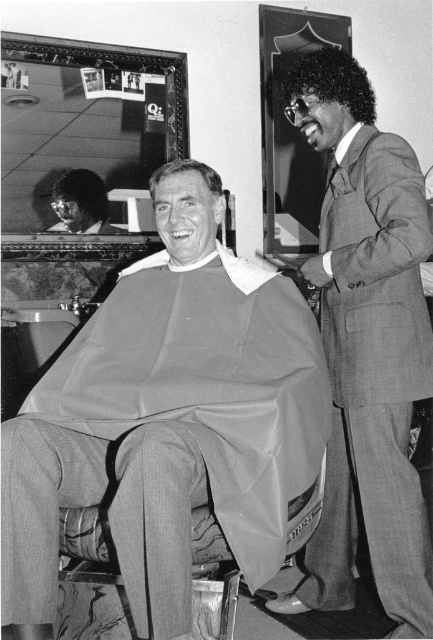
Question: Can you confirm if sleek black afro at upper right is bigger than shiny black hair at upper left?

Choices:
 (A) no
 (B) yes

Answer: (B)

Question: Can you confirm if shiny black hair at upper left is thinner than smooth gray hair at center?

Choices:
 (A) yes
 (B) no

Answer: (B)

Question: Which point appears closest to the camera in this image?

Choices:
 (A) (67, 346)
 (B) (314, 88)
 (C) (86, 172)
 (D) (187, 161)

Answer: (B)

Question: Does gray fabric at center have a greater width compared to smooth suit at right?

Choices:
 (A) yes
 (B) no

Answer: (A)

Question: Considering the real-world distances, which object is closest to the smooth gray hair at center?

Choices:
 (A) shiny black hair at upper left
 (B) sleek black afro at upper right
 (C) gray fabric at center

Answer: (B)

Question: Based on their relative distances, which object is nearer to the smooth suit at right?

Choices:
 (A) shiny black hair at upper left
 (B) sleek black afro at upper right
 (C) gray fabric at center
 (D) smooth gray hair at center

Answer: (C)